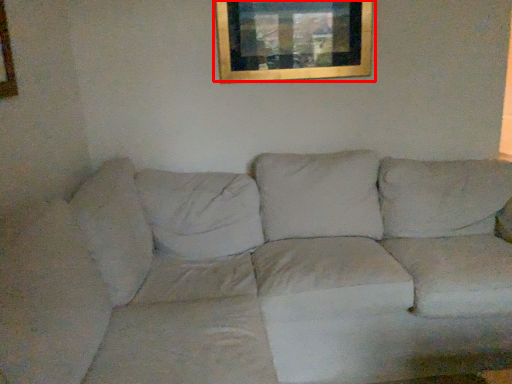
Question: From the image's perspective, what is the correct spatial relationship of picture frame (annotated by the red box) in relation to studio couch?

Choices:
 (A) below
 (B) above

Answer: (B)